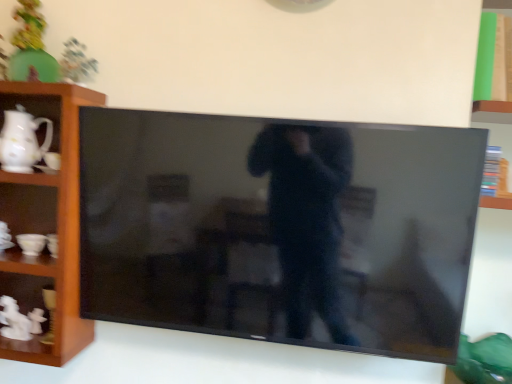
Question: Is wooden shelf at left not inside matte green toy at upper left?

Choices:
 (A) no
 (B) yes

Answer: (B)

Question: Is wooden shelf at left wider than matte green toy at upper left?

Choices:
 (A) no
 (B) yes

Answer: (B)

Question: Is wooden shelf at left to the left of matte green toy at upper left from the viewer's perspective?

Choices:
 (A) no
 (B) yes

Answer: (B)

Question: Considering the relative sizes of wooden shelf at left and matte green toy at upper left in the image provided, is wooden shelf at left bigger than matte green toy at upper left?

Choices:
 (A) no
 (B) yes

Answer: (B)

Question: From a real-world perspective, does wooden shelf at left sit lower than matte green toy at upper left?

Choices:
 (A) no
 (B) yes

Answer: (B)

Question: From a real-world perspective, relative to matte green toy at upper left, is white glossy pitcher at left vertically above or below?

Choices:
 (A) below
 (B) above

Answer: (A)

Question: Is point (15, 182) positioned closer to the camera than point (22, 6)?

Choices:
 (A) farther
 (B) closer

Answer: (A)

Question: From the image's perspective, relative to matte green toy at upper left, is white glossy pitcher at left above or below?

Choices:
 (A) below
 (B) above

Answer: (A)

Question: From their relative heights in the image, would you say white glossy pitcher at left is taller or shorter than matte green toy at upper left?

Choices:
 (A) tall
 (B) short

Answer: (B)

Question: Considering the positions of wooden shelf at left and matte green toy at upper left in the image, is wooden shelf at left taller or shorter than matte green toy at upper left?

Choices:
 (A) tall
 (B) short

Answer: (A)

Question: Choose the correct answer: Is wooden shelf at left inside matte green toy at upper left or outside it?

Choices:
 (A) inside
 (B) outside

Answer: (B)

Question: From a real-world perspective, is wooden shelf at left physically located above or below matte green toy at upper left?

Choices:
 (A) above
 (B) below

Answer: (B)

Question: Visually, is wooden shelf at left positioned to the left or to the right of matte green toy at upper left?

Choices:
 (A) right
 (B) left

Answer: (B)

Question: From the image's perspective, relative to black glossy tv at center, is wooden shelf at left above or below?

Choices:
 (A) below
 (B) above

Answer: (B)

Question: From a real-world perspective, is wooden shelf at left physically located above or below black glossy tv at center?

Choices:
 (A) above
 (B) below

Answer: (B)